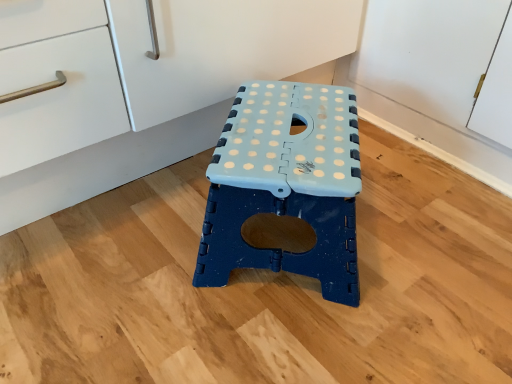
Where is `vacant area on top of blue plastic stool at center (from a real-world perspective)`? Image resolution: width=512 pixels, height=384 pixels. vacant area on top of blue plastic stool at center (from a real-world perspective) is located at coordinates (289, 133).